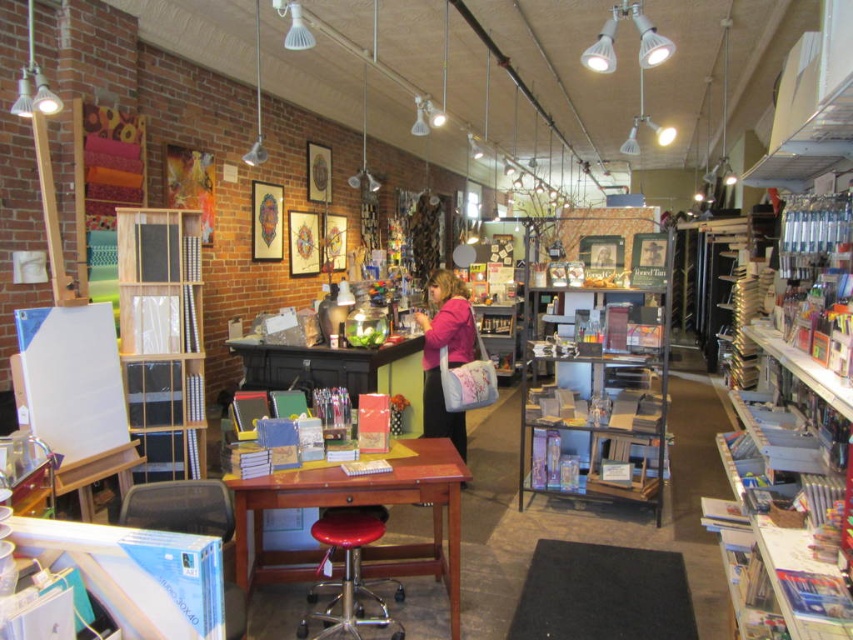
Is point (426, 385) positioned behind point (32, 26)?

Yes, point (426, 385) is farther from viewer.

Which is behind, point (445, 344) or point (28, 93)?

Positioned behind is point (445, 344).

Is point (434, 435) behind point (28, 38)?

That is True.

Where is `pink fabric purse at center`? pink fabric purse at center is located at coordinates (448, 355).

Based on the photo, between pink fabric purse at center and red leather stool at center, which one has more height?

pink fabric purse at center is taller.

Is point (431, 296) closer to viewer compared to point (358, 634)?

No, it is not.

What do you see at coordinates (448, 355) in the screenshot? This screenshot has height=640, width=853. I see `pink fabric purse at center` at bounding box center [448, 355].

Locate an element on the screen. This screenshot has height=640, width=853. pink fabric purse at center is located at coordinates (448, 355).

From the picture: Is white cardboard bookshelf at right to the left of metallic silver light fixture at upper left from the viewer's perspective?

No, white cardboard bookshelf at right is not to the left of metallic silver light fixture at upper left.

Between point (820, 538) and point (47, 92), which one is positioned behind?

Point (47, 92)

Identify the location of white cardboard bookshelf at right. The image size is (853, 640). (796, 429).

Image resolution: width=853 pixels, height=640 pixels. In order to click on white cardboard bookshelf at right in this screenshot , I will do `click(796, 429)`.